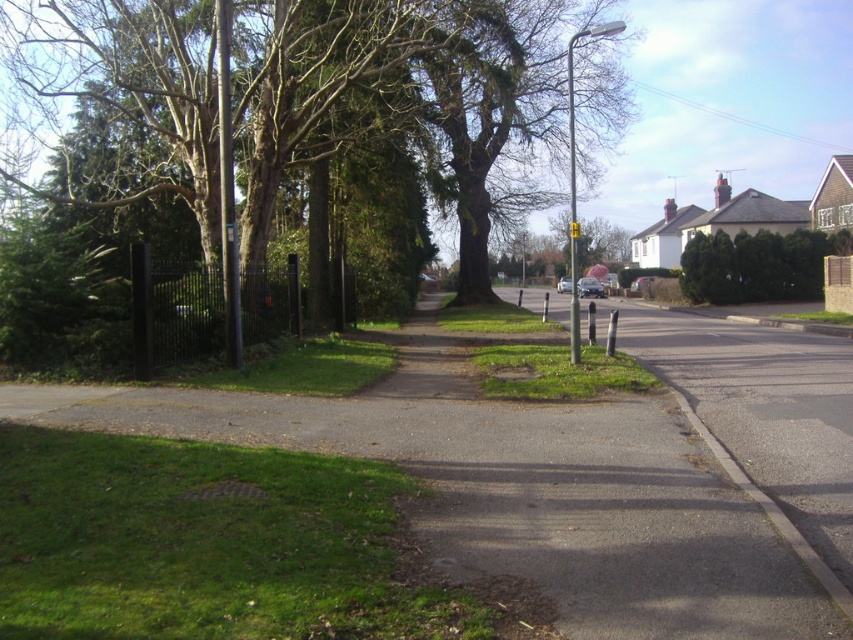
Is point (512, 432) less distant than point (71, 49)?

Yes.

Can you confirm if gravel path at center is positioned to the left of green leafy tree at center?

In fact, gravel path at center is to the right of green leafy tree at center.

What do you see at coordinates (521, 488) in the screenshot?
I see `gravel path at center` at bounding box center [521, 488].

Where is `gravel path at center`? The width and height of the screenshot is (853, 640). gravel path at center is located at coordinates (521, 488).

Between point (56, 36) and point (759, 288), which one is positioned in front?

Positioned in front is point (56, 36).

Is green leafy tree at center closer to camera compared to green leafy tree at upper right?

Yes, green leafy tree at center is in front of green leafy tree at upper right.

Does point (207, 29) lie behind point (695, 289)?

That is False.

This screenshot has width=853, height=640. In order to click on green leafy tree at center in this screenshot , I will do `click(392, 83)`.

Can you confirm if gravel path at center is wider than green leafy tree at upper right?

Indeed, gravel path at center has a greater width compared to green leafy tree at upper right.

From the picture: Which is above, gravel path at center or green leafy tree at upper right?

green leafy tree at upper right is higher up.

The height and width of the screenshot is (640, 853). What do you see at coordinates (521, 488) in the screenshot?
I see `gravel path at center` at bounding box center [521, 488].

The height and width of the screenshot is (640, 853). I want to click on gravel path at center, so click(521, 488).